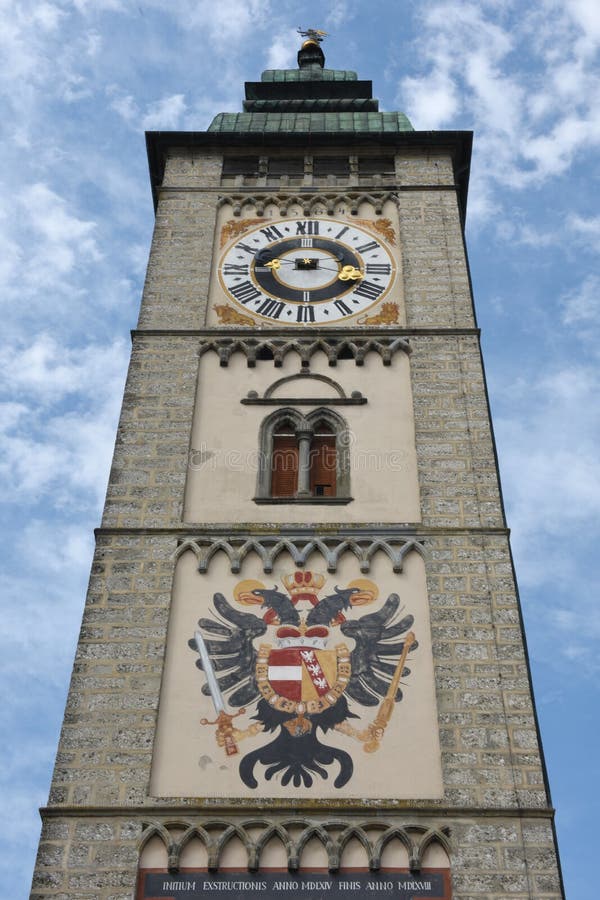
Identify the location of statue. (314, 29).